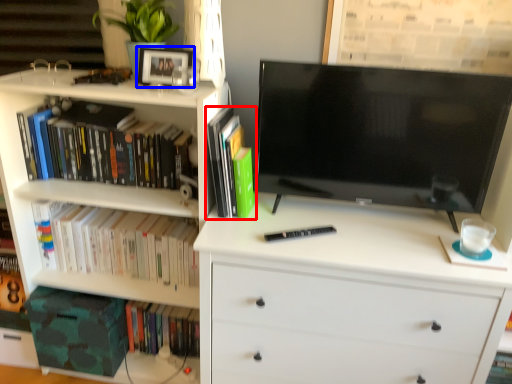
Question: Which object is further to the camera taking this photo, book (highlighted by a red box) or picture frame (highlighted by a blue box)?

Choices:
 (A) book
 (B) picture frame

Answer: (B)